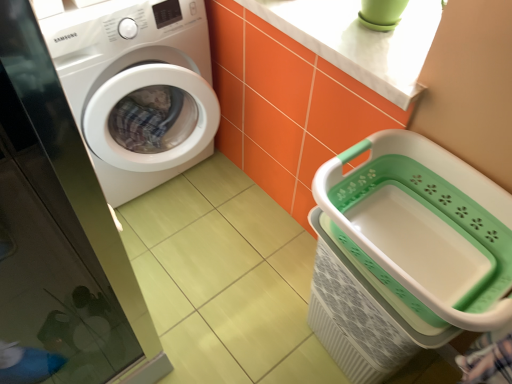
Question: Does white glossy washing machine at left have a greater height compared to white plastic laundry basket at lower right?

Choices:
 (A) yes
 (B) no

Answer: (A)

Question: From the image's perspective, is white glossy washing machine at left on white plastic laundry basket at lower right?

Choices:
 (A) no
 (B) yes

Answer: (B)

Question: From the image's perspective, is white glossy washing machine at left beneath white plastic laundry basket at lower right?

Choices:
 (A) no
 (B) yes

Answer: (A)

Question: Is the depth of white glossy washing machine at left less than that of white plastic laundry basket at lower right?

Choices:
 (A) no
 (B) yes

Answer: (A)

Question: Could white plastic laundry basket at lower right be considered to be inside white glossy washing machine at left?

Choices:
 (A) yes
 (B) no

Answer: (B)

Question: Is white glossy washing machine at left aimed at white plastic laundry basket at lower right?

Choices:
 (A) yes
 (B) no

Answer: (A)

Question: Can you confirm if white glossy washing machine at left is bigger than transparent glass screen door at left?

Choices:
 (A) no
 (B) yes

Answer: (B)

Question: Does white glossy washing machine at left have a greater height compared to transparent glass screen door at left?

Choices:
 (A) no
 (B) yes

Answer: (B)

Question: Is white glossy washing machine at left closer to the viewer compared to transparent glass screen door at left?

Choices:
 (A) yes
 (B) no

Answer: (B)

Question: Is white glossy washing machine at left turned away from transparent glass screen door at left?

Choices:
 (A) no
 (B) yes

Answer: (A)

Question: Is white glossy washing machine at left further to camera compared to transparent glass screen door at left?

Choices:
 (A) no
 (B) yes

Answer: (B)

Question: Can you confirm if white glossy washing machine at left is positioned to the right of transparent glass screen door at left?

Choices:
 (A) no
 (B) yes

Answer: (A)

Question: Can you confirm if transparent glass screen door at left is bigger than white marble countertop at upper center?

Choices:
 (A) no
 (B) yes

Answer: (B)